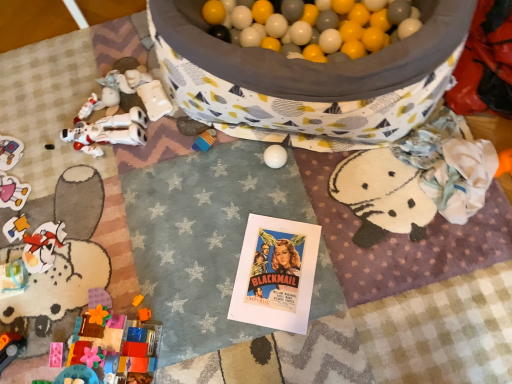
Locate an element on the screen. This screenshot has width=512, height=384. vacant space to the left of brick-like plastic blocks at lower left, which is counted as the 2th toy, starting from the bottom is located at coordinates (47, 335).